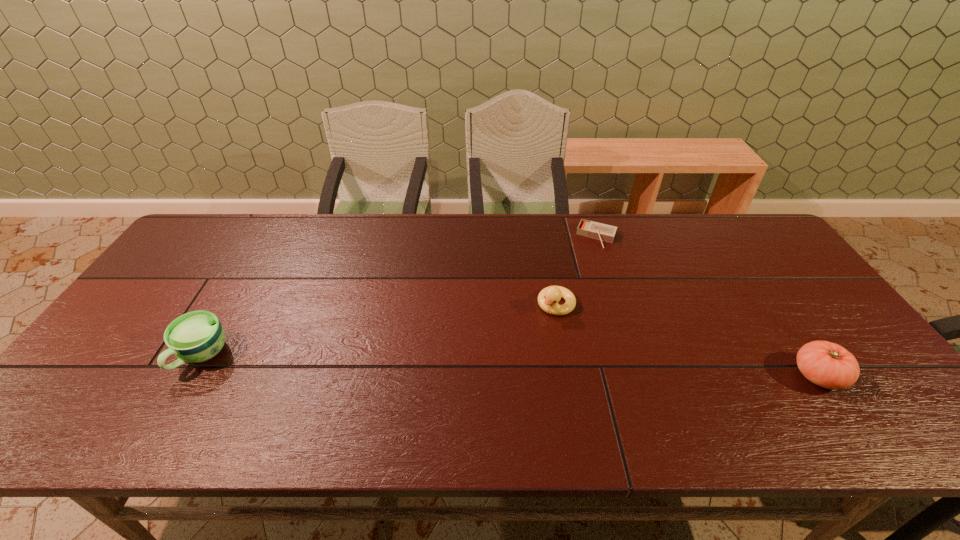
Where is `free area in between the shortest object and the second farthest object`? The height and width of the screenshot is (540, 960). free area in between the shortest object and the second farthest object is located at coordinates (577, 271).

Where is `free space that is in between the second farthest object and the tomato`? free space that is in between the second farthest object and the tomato is located at coordinates (687, 340).

Where is `free space between the farthest object and the leftmost object`? free space between the farthest object and the leftmost object is located at coordinates (400, 296).

Image resolution: width=960 pixels, height=540 pixels. Identify the location of object that is the third closest to the rightmost object. (194, 337).

Identify which object is the nearest to the second object from left to right. Please provide its 2D coordinates. Your answer should be formatted as a tuple, i.e. [(x, y)], where the tuple contains the x and y coordinates of a point satisfying the conditions above.

[(591, 229)]

Where is `free space in the image that satisfies the following two spatial constraints: 1. on the back side of the matchbox; 2. on the right side of the duckling`? The width and height of the screenshot is (960, 540). free space in the image that satisfies the following two spatial constraints: 1. on the back side of the matchbox; 2. on the right side of the duckling is located at coordinates (544, 237).

Locate an element on the screen. Image resolution: width=960 pixels, height=540 pixels. vacant area that satisfies the following two spatial constraints: 1. on the front side of the tomato; 2. on the right side of the second object from left to right is located at coordinates (569, 376).